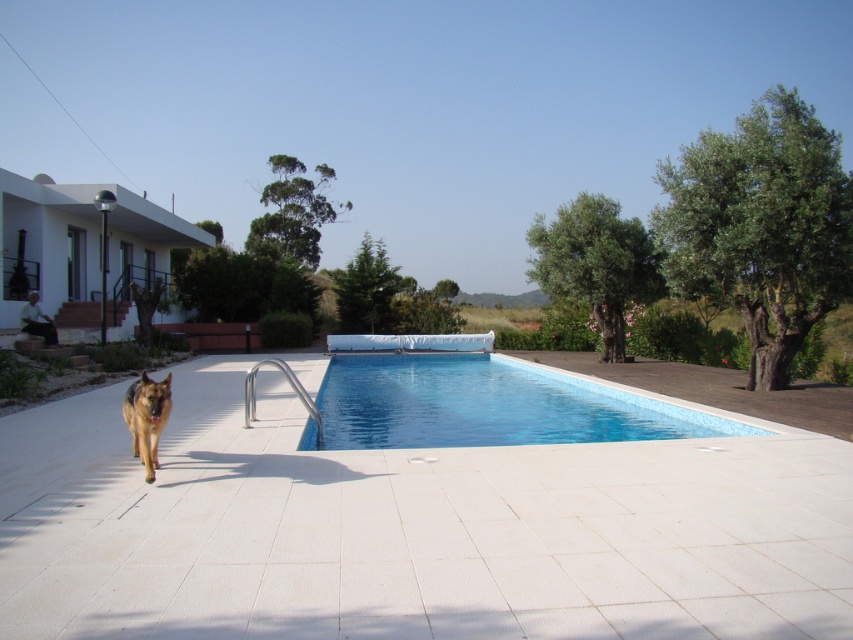
Question: Does blue smooth pool at center appear under golden brown fur dog at center?

Choices:
 (A) yes
 (B) no

Answer: (A)

Question: Among these points, which one is farthest from the camera?

Choices:
 (A) (450, 372)
 (B) (166, 374)

Answer: (A)

Question: Is blue smooth pool at center positioned in front of golden brown fur dog at center?

Choices:
 (A) yes
 (B) no

Answer: (B)

Question: In this image, where is blue smooth pool at center located relative to golden brown fur dog at center?

Choices:
 (A) left
 (B) right

Answer: (B)